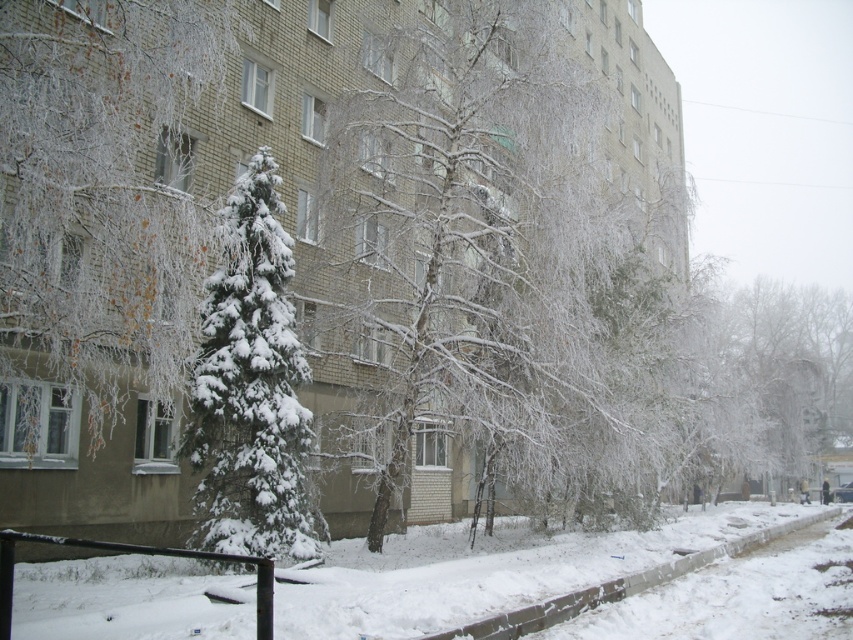
Looking at this image, can you confirm if snow-covered evergreen at left is positioned to the left of snow-covered evergreen at center?

Correct, you'll find snow-covered evergreen at left to the left of snow-covered evergreen at center.

Can you confirm if snow-covered evergreen at left is smaller than snow-covered evergreen at center?

Yes.

Measure the distance between point [135,200] and camera.

The distance of point [135,200] from camera is 11.18 meters.

Find the location of a particular element. Image resolution: width=853 pixels, height=640 pixels. snow-covered evergreen at left is located at coordinates (102, 189).

Between icy white branches at center and white snow pavement at lower center, which one has less height?

white snow pavement at lower center is shorter.

Find the location of a particular element. icy white branches at center is located at coordinates (509, 244).

Which is behind, point (492, 480) or point (105, 602)?

The point (492, 480) is behind.

The width and height of the screenshot is (853, 640). In order to click on icy white branches at center in this screenshot , I will do `click(509, 244)`.

Who is shorter, white snow pavement at lower center or snow-covered evergreen at center?

Standing shorter between the two is white snow pavement at lower center.

Which of these two, white snow pavement at lower center or snow-covered evergreen at center, stands taller?

snow-covered evergreen at center is taller.

Find the location of `white snow pavement at lower center`. white snow pavement at lower center is located at coordinates (495, 577).